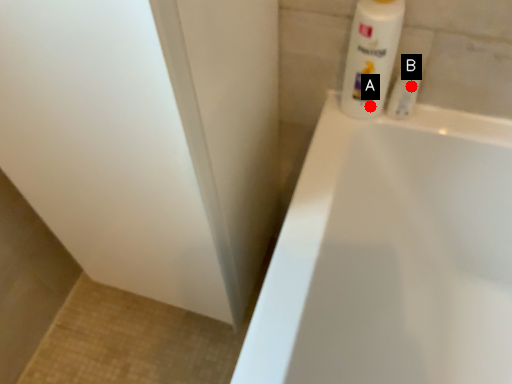
Question: Two points are circled on the image, labeled by A and B beside each circle. Which point is closer to the camera taking this photo?

Choices:
 (A) A is closer
 (B) B is closer

Answer: (B)